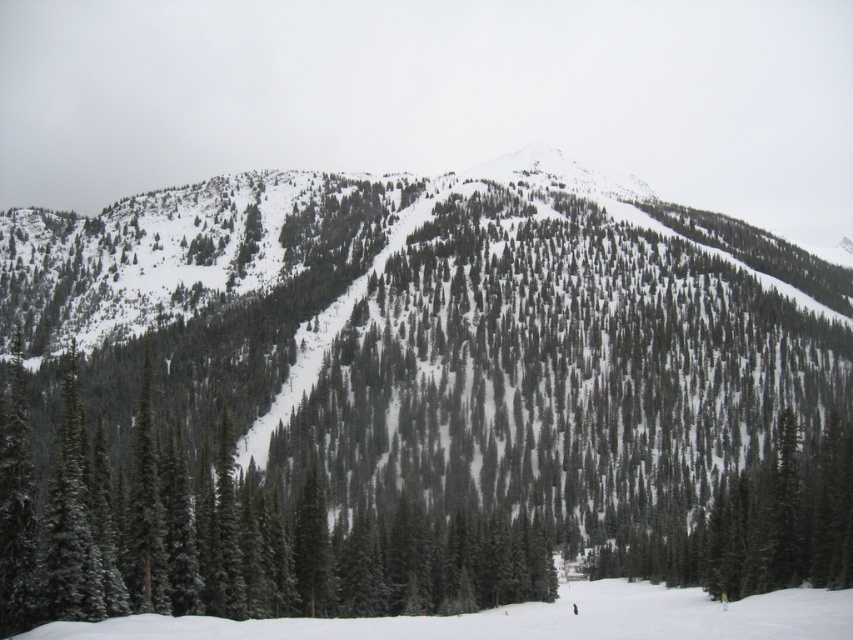
From the picture: Can you confirm if green textured pine at center is thinner than green textured pine tree at center?

No.

Consider the image. Can you confirm if green textured pine at center is shorter than green textured pine tree at center?

No.

Who is more forward, (566, 358) or (180, 536)?

Positioned in front is point (180, 536).

Identify the location of green textured pine at center. (410, 400).